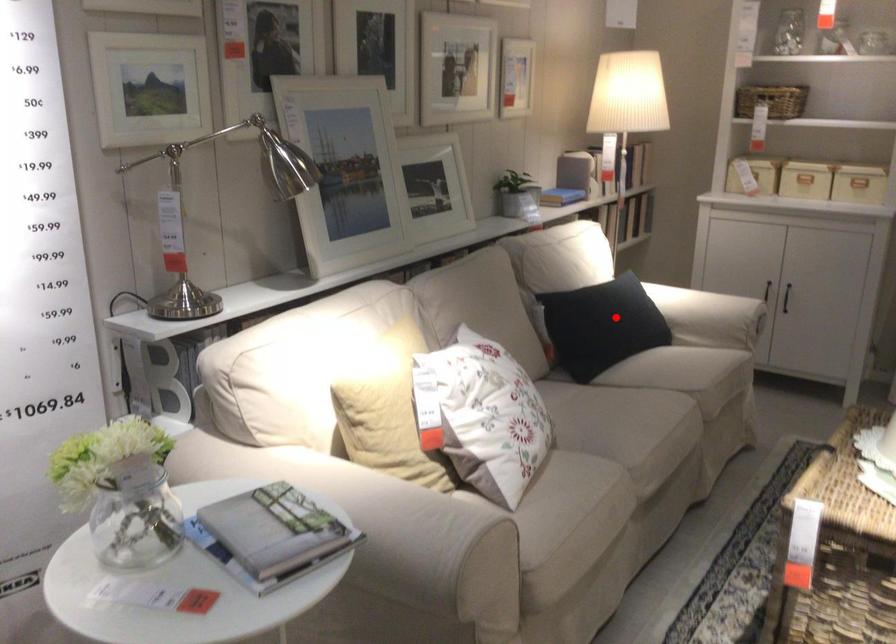
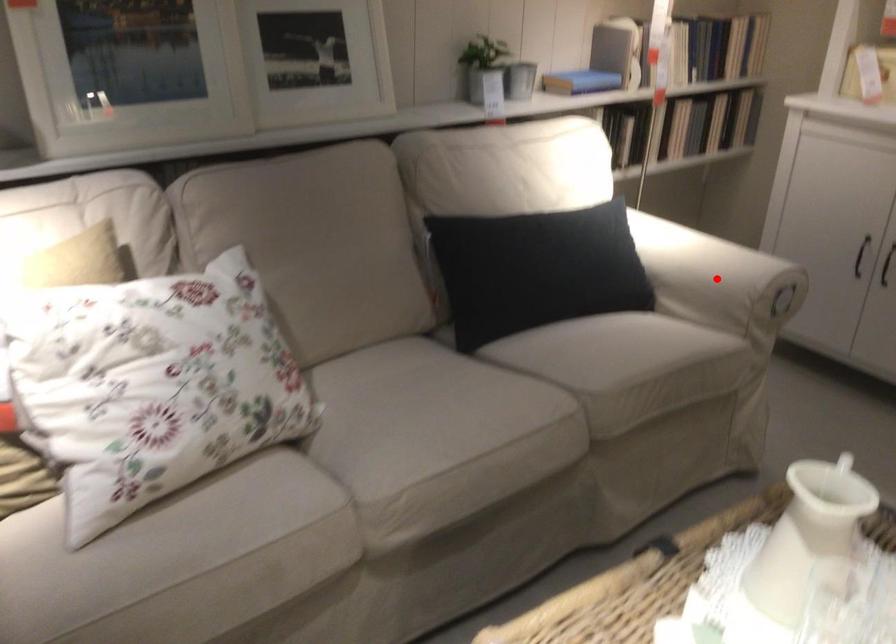
I am providing you with two images of the same scene from different viewpoints. A red point is marked on the first image and another point is marked on the second image. Is the red point in image1 aligned with the point shown in image2?

No